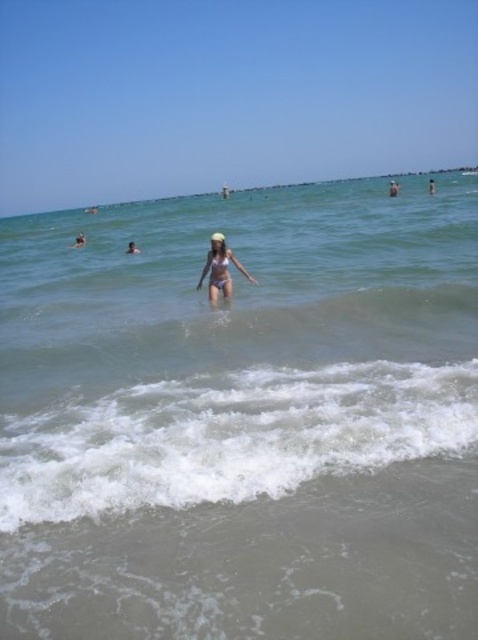
Who is higher up, light brown skin at upper center or smooth skin person at upper center?

smooth skin person at upper center is higher up.

Between light brown skin at upper center and smooth skin person at upper center, which one has more height?

Standing taller between the two is light brown skin at upper center.

Locate an element on the screen. The width and height of the screenshot is (478, 640). light brown skin at upper center is located at coordinates (392, 188).

Is clear water at center above smooth skin person at upper center?

Incorrect, clear water at center is not positioned above smooth skin person at upper center.

Does clear water at center have a lesser height compared to smooth skin person at upper center?

No.

What do you see at coordinates (242, 419) in the screenshot?
I see `clear water at center` at bounding box center [242, 419].

Where is `clear water at center`? This screenshot has width=478, height=640. clear water at center is located at coordinates coord(242,419).

Which is behind, point (217, 298) or point (80, 246)?

The point (80, 246) is more distant.

Is point (206, 268) farther from viewer compared to point (85, 236)?

That is False.

You are a GUI agent. You are given a task and a screenshot of the screen. Output one action in this format:
    pyautogui.click(x=<x>, y=<y>)
    Task: Click on the pink matte swimsuit at center
    This screenshot has height=640, width=478.
    Given the screenshot: What is the action you would take?
    pyautogui.click(x=219, y=268)